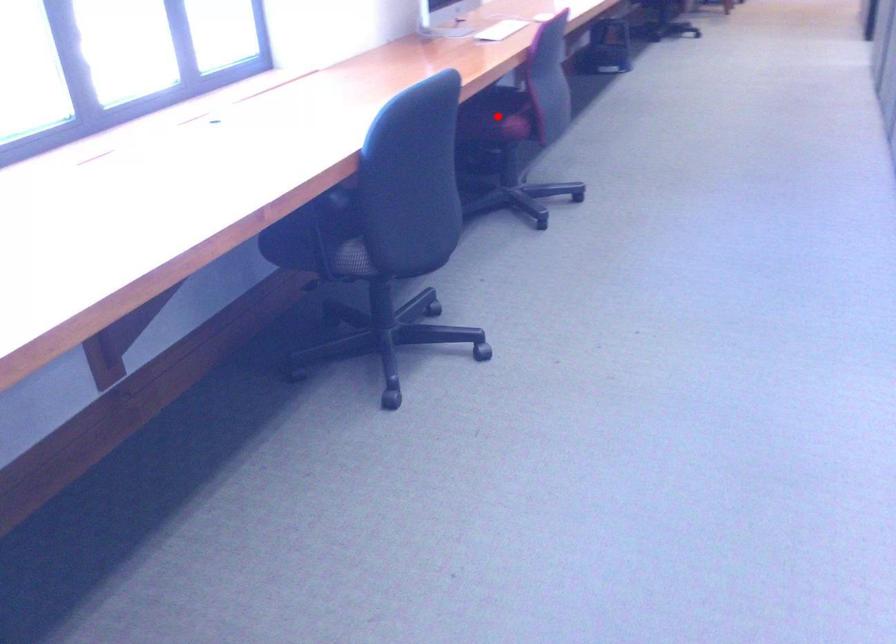
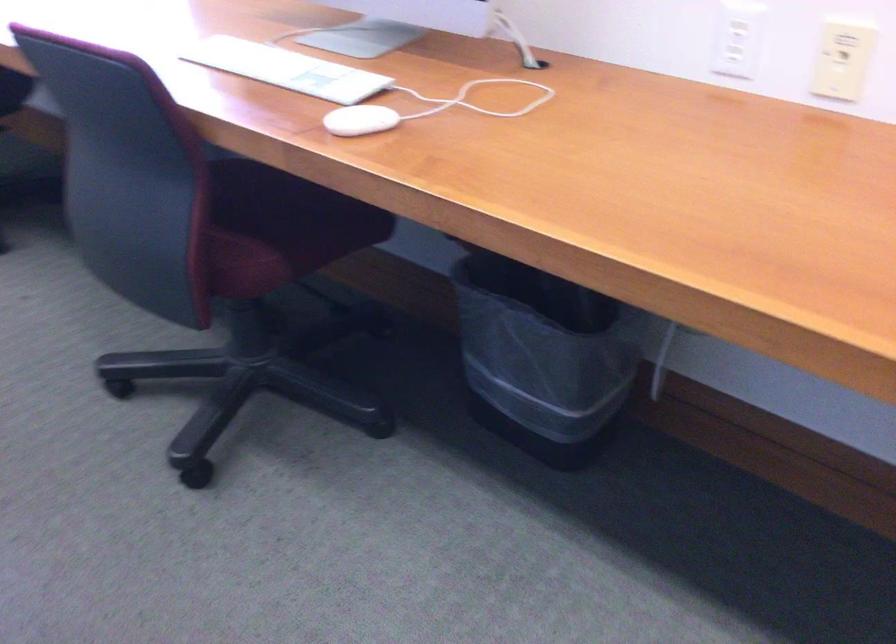
Question: I am providing you with two images of the same scene from different viewpoints. A red point is marked on the first image. Can you still see the location of the red point in image 2?

Choices:
 (A) Yes
 (B) No

Answer: (B)